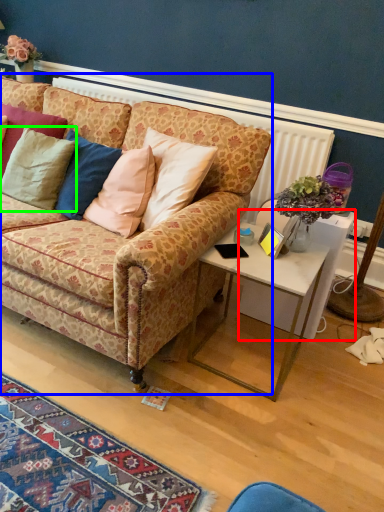
Question: Considering the real-world distances, which object is farthest from desk (highlighted by a red box)? studio couch (highlighted by a blue box) or pillow (highlighted by a green box)?

Choices:
 (A) studio couch
 (B) pillow

Answer: (B)